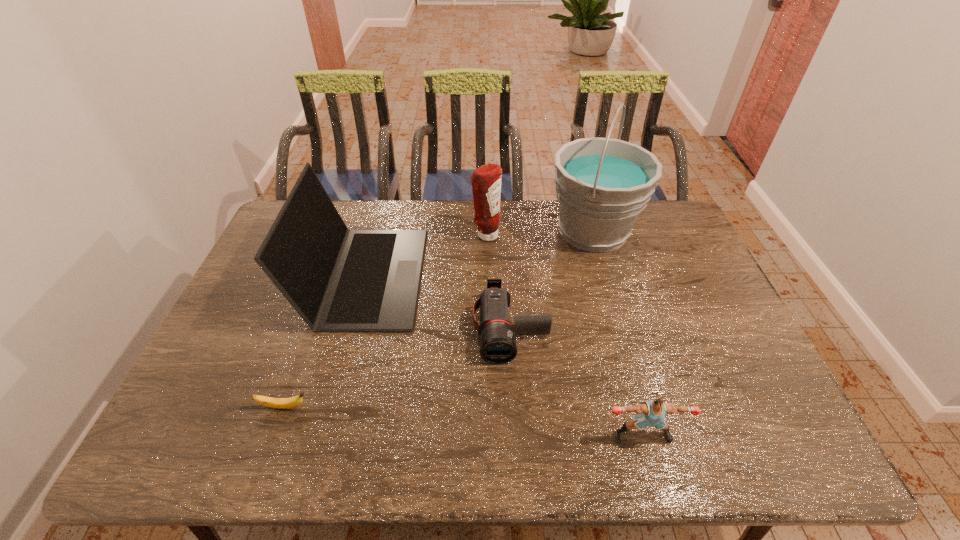
Where is `bucket`? The image size is (960, 540). bucket is located at coordinates (602, 184).

Identify the location of laptop. This screenshot has height=540, width=960. (337, 279).

Identify the location of condiment. This screenshot has height=540, width=960. (486, 180).

The height and width of the screenshot is (540, 960). What are the coordinates of `the nearest object` in the screenshot? It's located at (652, 413).

Locate an element on the screen. The width and height of the screenshot is (960, 540). puncher is located at coordinates (652, 413).

Identify the location of camcorder. (497, 341).

Where is `the second nearest object`? the second nearest object is located at coordinates (281, 403).

What are the coordinates of `the shortest object` in the screenshot? It's located at (281, 403).

At what (x,y) coordinates should I click in order to perform the action: click on blank space located 0.300m on the left of the bucket. Please return your answer as a coordinate pair (x, y). This screenshot has width=960, height=540. Looking at the image, I should click on (460, 231).

Identify the location of vacant space located on the screen of the laptop. (524, 276).